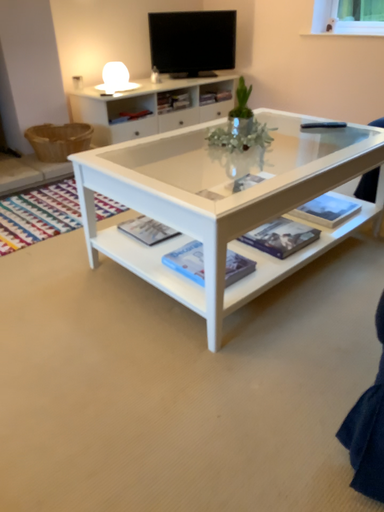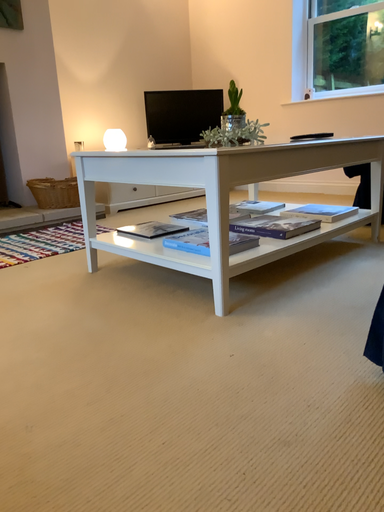
Question: How did the camera likely rotate when shooting the video?

Choices:
 (A) rotated downward
 (B) rotated upward

Answer: (B)